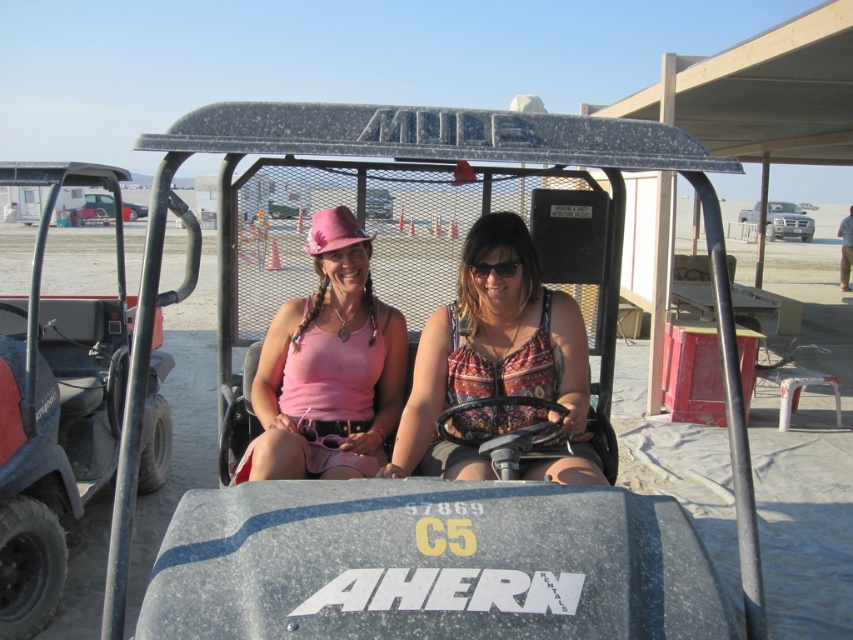
You are a photographer taking a picture of the matte black golf cart at center and the printed fabric tank top at center. Which object will appear larger in your photo?

The matte black golf cart at center will appear larger in the photo because it is closer to the viewer than the printed fabric tank top at center.

You are a photographer aiming to capture a shot of the matte black golf cart at center and the printed fabric tank top at center. If you want to frame the golf cart to the right of the tank top in your photo, should you move the cart to your left or right?

The matte black golf cart at center is currently to the left of the printed fabric tank top at center. To frame the golf cart to the right of the tank top, you should move the cart to your right so that it shifts to the right side relative to the tank top.

You are a photographer trying to capture the printed fabric tank top at center and the black plastic goggles at center in a clear photo. Which object should you zoom in on to ensure both are in focus, considering their sizes?

The printed fabric tank top at center is bigger than black plastic goggles at center, so you should zoom in on the printed fabric tank top at center to ensure both are in focus.